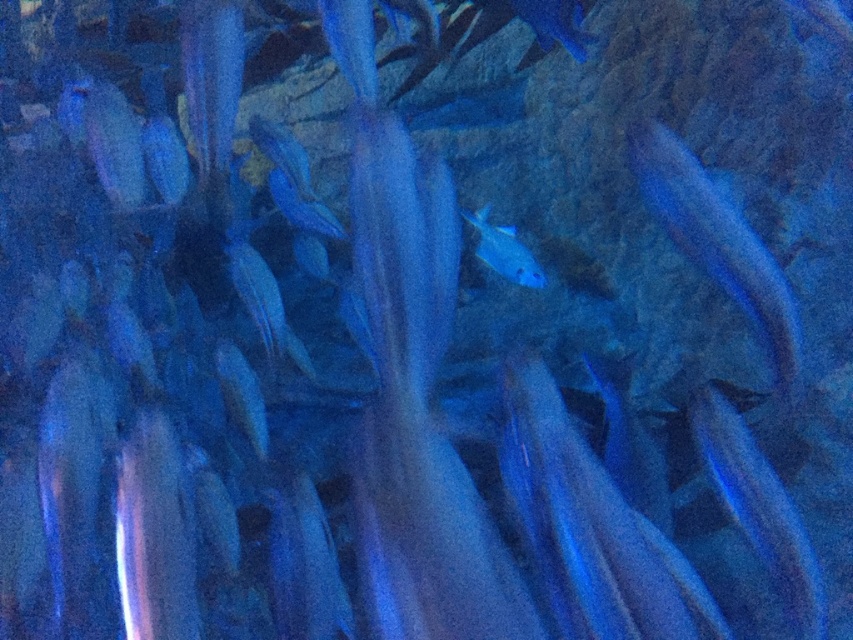
You are an underwater photographer aiming to capture a photo of the glossy blue fish at right. You are currently positioned at point (718, 243). Is the glossy blue fish at right located to your left or right side?

The glossy blue fish at right is located to your right side since you are positioned at point (718, 243), and the fish is at the right of that point.

You are a marine biologist observing an underwater scene in an aquarium. You notice two glossy blue fish at right. How far apart are they from each other?

The glossy blue fish at right are 1.69 meters apart from each other.

You are an underwater photographer aiming to capture a photo of both the glossy blue fish at right and the glossy blue fish at center. Based on their positions, which fish should you focus on first to ensure both are in the frame?

The glossy blue fish at right is located below the glossy blue fish at center. To capture both in the frame, focus on the glossy blue fish at center first, then adjust to include the one below it.